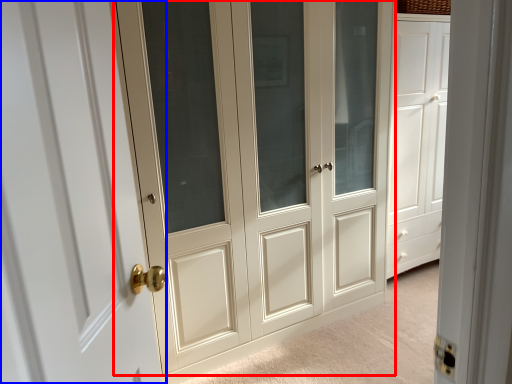
Question: Which of the following is the closest to the observer, door (highlighted by a red box) or door (highlighted by a blue box)?

Choices:
 (A) door
 (B) door

Answer: (B)